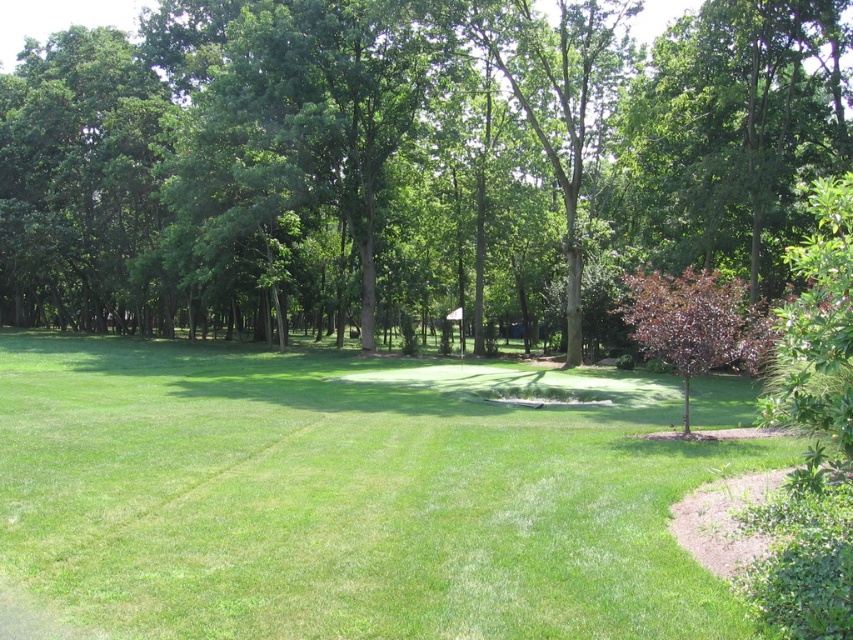
Between point (84, 371) and point (672, 358), which one is positioned in front?

Point (672, 358) is in front.

Is point (90, 468) less distant than point (694, 328)?

Yes, point (90, 468) is in front of point (694, 328).

The height and width of the screenshot is (640, 853). What do you see at coordinates (346, 497) in the screenshot?
I see `green grass at center` at bounding box center [346, 497].

In order to click on green grass at center in this screenshot , I will do `click(346, 497)`.

Between point (750, 243) and point (675, 371), which one is positioned behind?

The point (750, 243) is behind.

Between point (642, 122) and point (740, 364), which one is positioned behind?

The point (642, 122) is more distant.

What are the coordinates of `green leafy tree at center` in the screenshot? It's located at (407, 161).

Is point (624, 234) less distant than point (62, 580)?

No, it is not.

Can you confirm if green leafy tree at center is taller than green grass at center?

Yes, green leafy tree at center is taller than green grass at center.

Does point (599, 227) come behind point (332, 502)?

Yes, point (599, 227) is farther from viewer.

Image resolution: width=853 pixels, height=640 pixels. Find the location of `green leafy tree at center`. green leafy tree at center is located at coordinates click(407, 161).